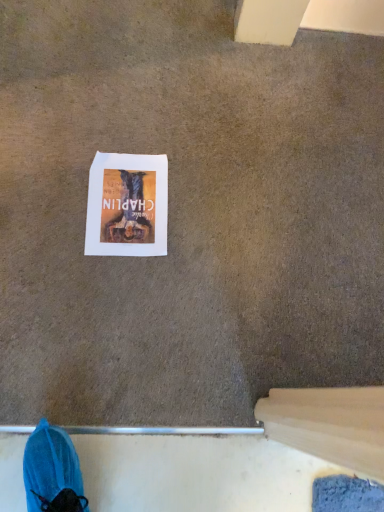
Identify the location of vacant area that is in front of white paper at center. 91,288.